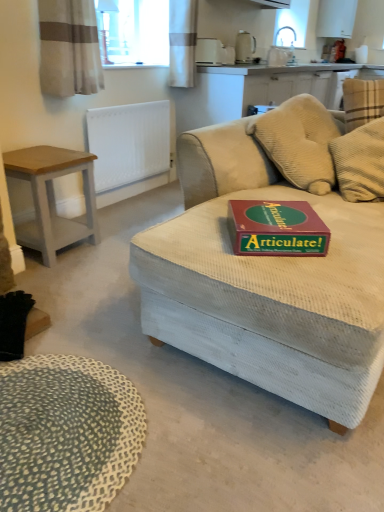
Where is `beige fabric curtain at upper left, which is counted as the second curtain, starting from the right`? The width and height of the screenshot is (384, 512). beige fabric curtain at upper left, which is counted as the second curtain, starting from the right is located at coordinates (69, 48).

How much space does matte beige kettle at upper center, acting as the 1th appliance starting from the right, occupy horizontally?

matte beige kettle at upper center, acting as the 1th appliance starting from the right, is 6.18 inches wide.

At what (x,y) coordinates should I click in order to perform the action: click on textured beige couch at center. Please return your answer as a coordinate pair (x, y). Looking at the image, I should click on (266, 284).

At what (x,y) coordinates should I click in order to perform the action: click on beige fabric curtain at upper left, placed as the first curtain when sorted from left to right. Please return your answer as a coordinate pair (x, y). Looking at the image, I should click on (69, 48).

What's the angular difference between white plastic toaster at upper center, which appears as the second appliance when viewed from the top, and maroon cardboard game box at center's facing directions?

They differ by 84.5 degrees in their facing directions.

Is white plastic toaster at upper center, which is the 1th appliance in bottom-to-top order, inside the boundaries of maroon cardboard game box at center, or outside?

white plastic toaster at upper center, which is the 1th appliance in bottom-to-top order, lies outside maroon cardboard game box at center.

Are white plastic toaster at upper center, which ranks as the first appliance in left-to-right order, and maroon cardboard game box at center located far from each other?

Yes, white plastic toaster at upper center, which ranks as the first appliance in left-to-right order, is far from maroon cardboard game box at center.

In the image, is white plastic toaster at upper center, which appears as the second appliance when viewed from the top, positioned in front of or behind maroon cardboard game box at center?

white plastic toaster at upper center, which appears as the second appliance when viewed from the top, is behind maroon cardboard game box at center.

From a real-world perspective, is beige fabric curtain at upper left, positioned as the 1th curtain in front-to-back order, physically located above or below maroon cardboard game box at center?

beige fabric curtain at upper left, positioned as the 1th curtain in front-to-back order, is above maroon cardboard game box at center.

Is beige fabric curtain at upper left, positioned as the 1th curtain in front-to-back order, to the right of maroon cardboard game box at center from the viewer's perspective?

No.

From the picture: Considering the relative sizes of beige fabric curtain at upper left, which is counted as the second curtain, starting from the right, and maroon cardboard game box at center in the image provided, is beige fabric curtain at upper left, which is counted as the second curtain, starting from the right, taller than maroon cardboard game box at center?

Yes.

From a real-world perspective, is textured beige mat at lower left on top of matte beige kettle at upper center, the 1th appliance in the back-to-front sequence?

No, from a real-world perspective, textured beige mat at lower left is not above matte beige kettle at upper center, the 1th appliance in the back-to-front sequence.

From the image's perspective, relative to matte beige kettle at upper center, which is the second appliance in bottom-to-top order, is textured beige mat at lower left above or below?

textured beige mat at lower left is situated lower than matte beige kettle at upper center, which is the second appliance in bottom-to-top order, in the image.

Which point is more forward, [64,442] or [239,37]?

The point [64,442] is closer.

What's the angular difference between textured beige couch at center and white textured curtain at upper center, arranged as the second curtain when viewed from the left,'s facing directions?

The facing directions of textured beige couch at center and white textured curtain at upper center, arranged as the second curtain when viewed from the left, are 91.2 degrees apart.

Is point (312, 348) closer to camera compared to point (188, 33)?

That is True.

Measure the distance from textured beige couch at center to white textured curtain at upper center, arranged as the second curtain when viewed from the left.

textured beige couch at center and white textured curtain at upper center, arranged as the second curtain when viewed from the left, are 1.89 meters apart from each other.

Based on the photo, from a real-world perspective, relative to white textured curtain at upper center, arranged as the second curtain when viewed from the left, is textured beige couch at center vertically above or below?

Clearly, from a real-world perspective, textured beige couch at center is below white textured curtain at upper center, arranged as the second curtain when viewed from the left.

From a real-world perspective, is white textured radiator at upper left above or below maroon cardboard game box at center?

white textured radiator at upper left is situated lower than maroon cardboard game box at center in the real world.

What are the coordinates of `radiator behind the maroon cardboard game box at center` in the screenshot? It's located at (129, 143).

Between white textured radiator at upper left and maroon cardboard game box at center, which one has smaller width?

Thinner between the two is white textured radiator at upper left.

Is white textured radiator at upper left oriented away from maroon cardboard game box at center?

That's not correct — white textured radiator at upper left is not looking away from maroon cardboard game box at center.

From a real-world perspective, is matte beige kettle at upper center, which is the second appliance in bottom-to-top order, physically below textured beige mat at lower left?

No, from a real-world perspective, matte beige kettle at upper center, which is the second appliance in bottom-to-top order, is not beneath textured beige mat at lower left.

Is matte beige kettle at upper center, acting as the 1th appliance starting from the right, directly adjacent to textured beige mat at lower left?

matte beige kettle at upper center, acting as the 1th appliance starting from the right, and textured beige mat at lower left are clearly separated.

Is point (245, 52) closer or farther from the camera than point (48, 467)?

Point (245, 52) is farther from the camera than point (48, 467).

Based on the photo, from the image's perspective, which one is positioned higher, matte beige kettle at upper center, the 1th appliance in the back-to-front sequence, or textured beige mat at lower left?

matte beige kettle at upper center, the 1th appliance in the back-to-front sequence, appears higher in the image.

Are white textured curtain at upper center, which is counted as the 1th curtain, starting from the right, and textured beige couch at center beside each other?

No, white textured curtain at upper center, which is counted as the 1th curtain, starting from the right, is not in contact with textured beige couch at center.

In the image, there is a white textured curtain at upper center, which ranks as the 2th curtain in front-to-back order. Identify the location of studio couch below it (from the image's perspective). This screenshot has width=384, height=512. (266, 284).

Consider the image. From a real-world perspective, which is physically below, white textured curtain at upper center, which ranks as the 2th curtain in front-to-back order, or textured beige couch at center?

From a 3D spatial view, textured beige couch at center is below.

From the image's perspective, does white textured curtain at upper center, which is counted as the 1th curtain, starting from the right, appear lower than textured beige couch at center?

No.

The image size is (384, 512). I want to click on the 1st appliance positioned above the maroon cardboard game box at center (from the image's perspective), so click(213, 52).

This screenshot has height=512, width=384. Identify the location of paperback book that appears in front of the beige fabric curtain at upper left, which is counted as the second curtain, starting from the right. (276, 228).

Which object lies further to the anchor point light gray wood side table at left, white textured radiator at upper left or white textured curtain at upper center, which is counted as the 1th curtain, starting from the right?

Among the two, white textured curtain at upper center, which is counted as the 1th curtain, starting from the right, is located further to light gray wood side table at left.

In the scene shown: Which object lies further to the anchor point white plastic toaster at upper center, which ranks as the first appliance in left-to-right order, matte beige kettle at upper center, acting as the 2th appliance starting from the left, or white textured radiator at upper left?

white textured radiator at upper left is positioned further to the anchor white plastic toaster at upper center, which ranks as the first appliance in left-to-right order.

Looking at this image, estimate the real-world distances between objects in this image. Which object is closer to light gray wood side table at left, white plastic toaster at upper center, which appears as the second appliance when viewed from the top, or white textured curtain at upper center, which ranks as the 2th curtain in front-to-back order?

Among the two, white textured curtain at upper center, which ranks as the 2th curtain in front-to-back order, is located nearer to light gray wood side table at left.

Based on their spatial positions, is matte beige kettle at upper center, acting as the 2th appliance starting from the left, or light gray wood side table at left closer to textured beige couch at center?

The object closer to textured beige couch at center is light gray wood side table at left.

Estimate the real-world distances between objects in this image. Which object is further from white textured curtain at upper center, which ranks as the 2th curtain in front-to-back order, matte beige kettle at upper center, acting as the 1th appliance starting from the right, or light gray wood side table at left?

light gray wood side table at left lies further to white textured curtain at upper center, which ranks as the 2th curtain in front-to-back order, than the other object.

When comparing their distances from textured beige mat at lower left, does maroon cardboard game box at center or beige fabric curtain at upper left, which is counted as the second curtain, starting from the right, seem further?

beige fabric curtain at upper left, which is counted as the second curtain, starting from the right.

Which object lies nearer to the anchor point maroon cardboard game box at center, textured beige couch at center or white plastic toaster at upper center, which ranks as the first appliance in left-to-right order?

Among the two, textured beige couch at center is located nearer to maroon cardboard game box at center.

Looking at the image, which one is located closer to textured beige mat at lower left, white textured curtain at upper center, arranged as the second curtain when viewed from the left, or white plastic toaster at upper center, which is the 1th appliance in bottom-to-top order?

Based on the image, white textured curtain at upper center, arranged as the second curtain when viewed from the left, appears to be nearer to textured beige mat at lower left.

Find the location of a particular element. The image size is (384, 512). paperback book that lies between white textured curtain at upper center, which ranks as the 2th curtain in front-to-back order, and textured beige mat at lower left from top to bottom is located at coordinates (276, 228).

At what (x,y) coordinates should I click in order to perform the action: click on radiator located between beige fabric curtain at upper left, positioned as the 1th curtain in front-to-back order, and matte beige kettle at upper center, acting as the 2th appliance starting from the left, in the depth direction. Please return your answer as a coordinate pair (x, y). The height and width of the screenshot is (512, 384). Looking at the image, I should click on tap(129, 143).

At what (x,y) coordinates should I click in order to perform the action: click on radiator positioned between beige fabric curtain at upper left, which is counted as the second curtain, starting from the right, and white plastic toaster at upper center, which is the 1th appliance in bottom-to-top order, from near to far. Please return your answer as a coordinate pair (x, y). Looking at the image, I should click on (129, 143).

I want to click on radiator between white plastic toaster at upper center, which ranks as the first appliance in left-to-right order, and light gray wood side table at left in the up-down direction, so click(x=129, y=143).